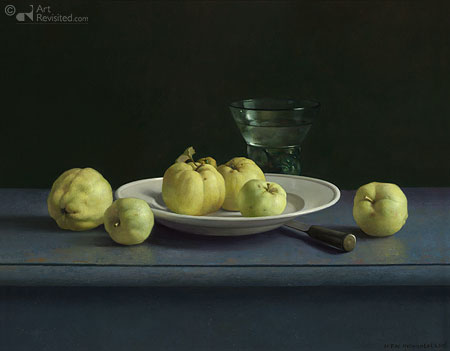
The image size is (450, 351). What are the coordinates of `wall` in the screenshot? It's located at (112, 104).